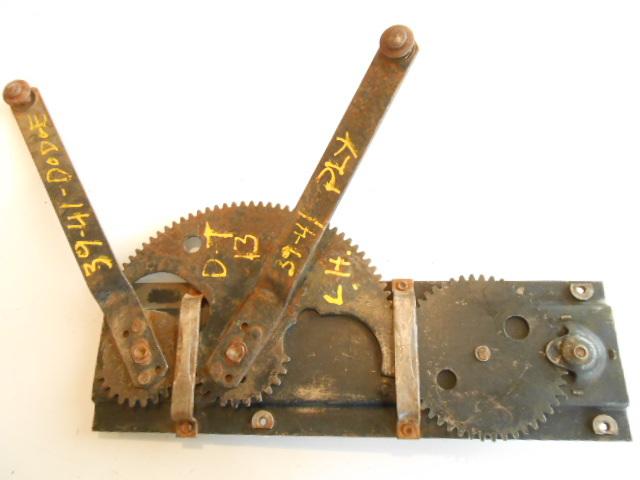
The height and width of the screenshot is (480, 640). In order to click on handle in this screenshot , I will do `click(388, 79)`, `click(40, 149)`.